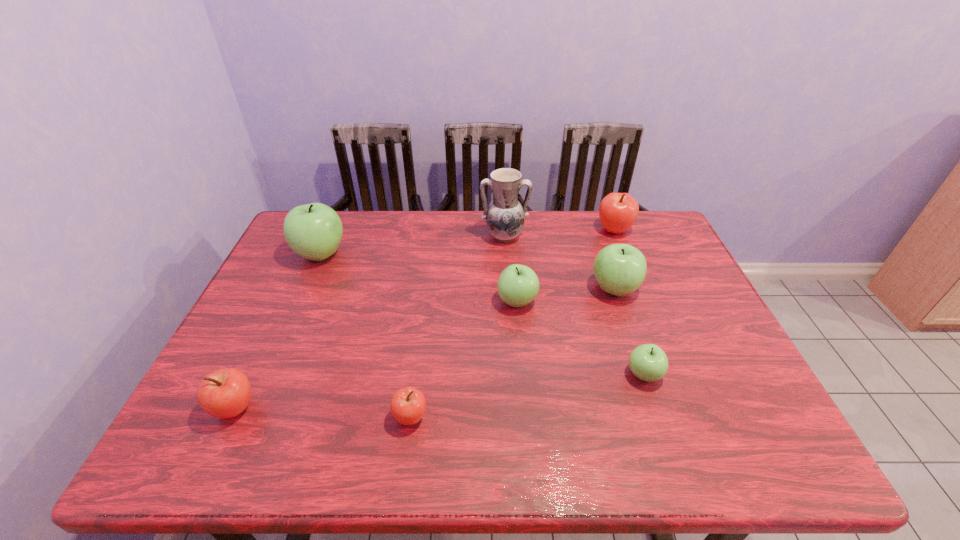
Select which object appears as the seventh closest to the third biggest green apple. Please provide its 2D coordinates. Your answer should be formatted as a tuple, i.e. [(x, y)], where the tuple contains the x and y coordinates of a point satisfying the conditions above.

[(225, 393)]

Image resolution: width=960 pixels, height=540 pixels. I want to click on the sixth closest object relative to the pottery, so click(408, 404).

Select which apple appears as the fourth closest to the second smallest pink apple. Please provide its 2D coordinates. Your answer should be formatted as a tuple, i.e. [(x, y)], where the tuple contains the x and y coordinates of a point satisfying the conditions above.

[(648, 362)]

I want to click on apple that is the fifth closest to the pottery, so click(648, 362).

I want to click on the second closest green apple relative to the smallest green apple, so click(518, 285).

The height and width of the screenshot is (540, 960). I want to click on green apple that is the fourth closest to the farthest pink apple, so click(313, 231).

You are a GUI agent. You are given a task and a screenshot of the screen. Output one action in this format:
    pyautogui.click(x=<x>, y=<y>)
    Task: Click on the pink apple that is the closest to the smallest pink apple
    
    Given the screenshot: What is the action you would take?
    [225, 393]

You are a GUI agent. You are given a task and a screenshot of the screen. Output one action in this format:
    pyautogui.click(x=<x>, y=<y>)
    Task: Click on the second closest pink apple to the tallest object
    This screenshot has height=540, width=960.
    Given the screenshot: What is the action you would take?
    coord(408,404)

Where is `vacant space that satisfies the following two spatial constraints: 1. on the front side of the fourth apple from right to left; 2. on the right side of the nearest green apple`? The width and height of the screenshot is (960, 540). vacant space that satisfies the following two spatial constraints: 1. on the front side of the fourth apple from right to left; 2. on the right side of the nearest green apple is located at coordinates (523, 375).